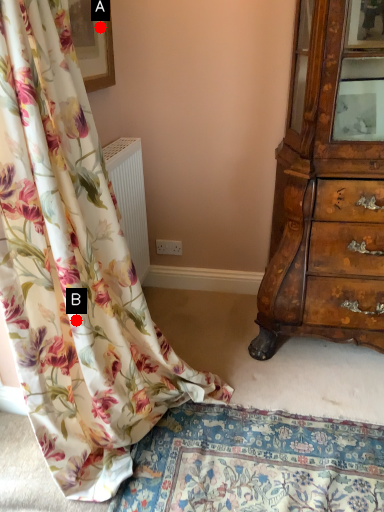
Question: Two points are circled on the image, labeled by A and B beside each circle. Among these points, which one is farthest from the camera?

Choices:
 (A) A is further
 (B) B is further

Answer: (A)